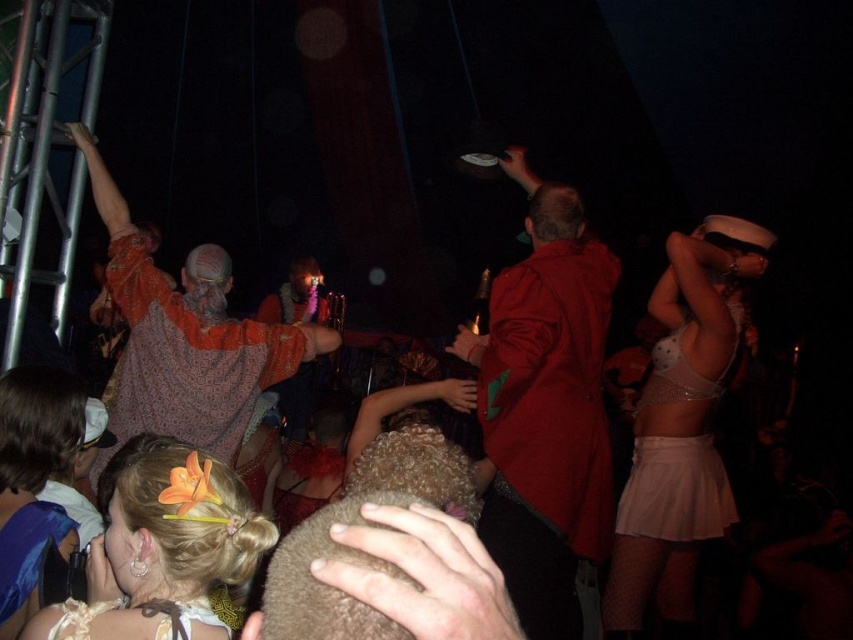
Question: Among these objects, which one is farthest from the camera?

Choices:
 (A) blonde hair with flower at center
 (B) pink satin skirt at lower right
 (C) matte red jacket at center
 (D) white mesh skirt at upper right

Answer: (B)

Question: In this image, where is patterned fabric shirt at upper left located relative to pink satin skirt at lower right?

Choices:
 (A) left
 (B) right

Answer: (A)

Question: Which point appears farthest from the camera in this image?

Choices:
 (A) (94, 561)
 (B) (96, 193)
 (C) (502, 301)
 (D) (685, 346)

Answer: (B)

Question: Which point appears farthest from the camera in this image?

Choices:
 (A) (123, 388)
 (B) (572, 621)
 (C) (670, 380)
 (D) (711, 300)

Answer: (A)

Question: Can you confirm if white mesh skirt at upper right is smaller than blonde hair with flower at center?

Choices:
 (A) no
 (B) yes

Answer: (A)

Question: Does white mesh skirt at upper right appear on the left side of pink satin skirt at lower right?

Choices:
 (A) no
 (B) yes

Answer: (B)